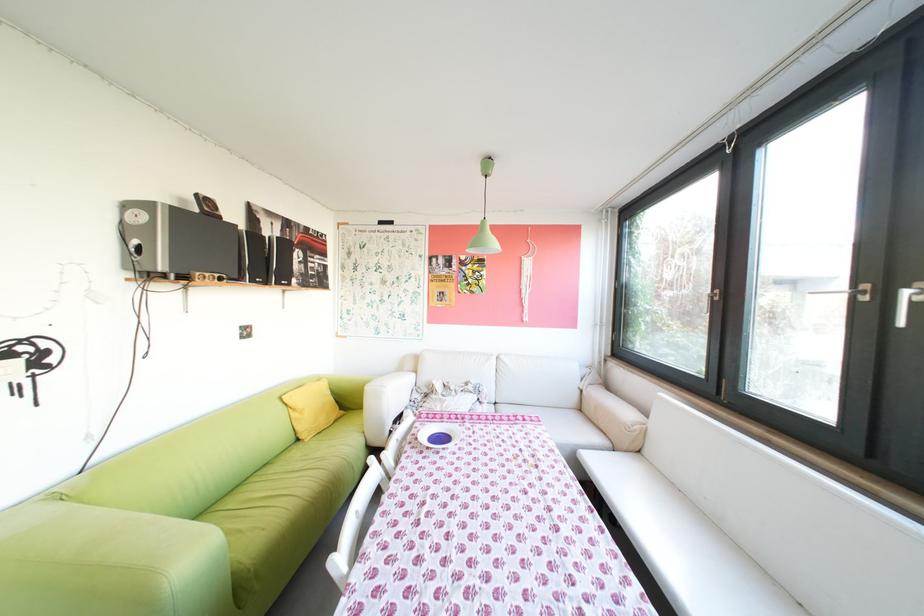
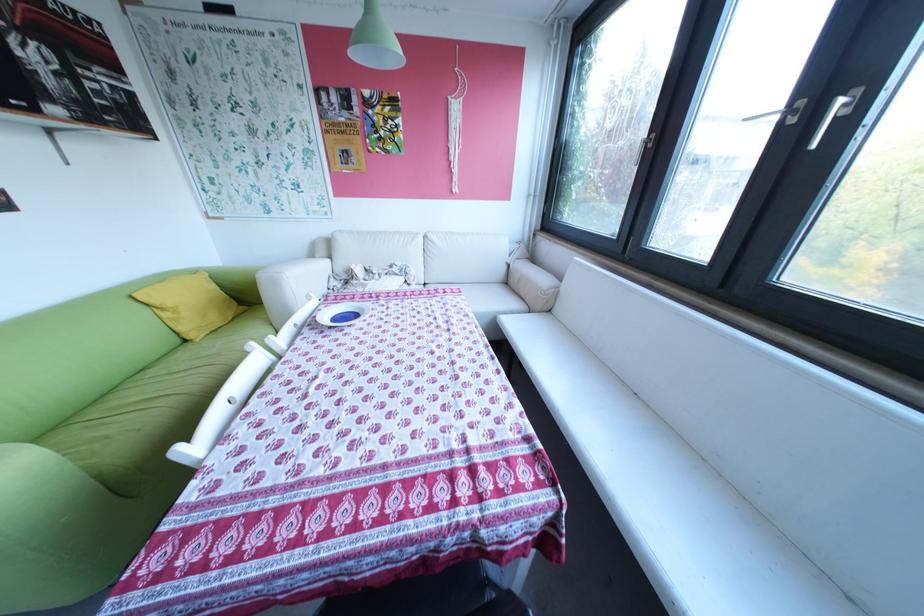
Find the pixel in the second image that matches pixel 507 403 in the first image.

(438, 284)